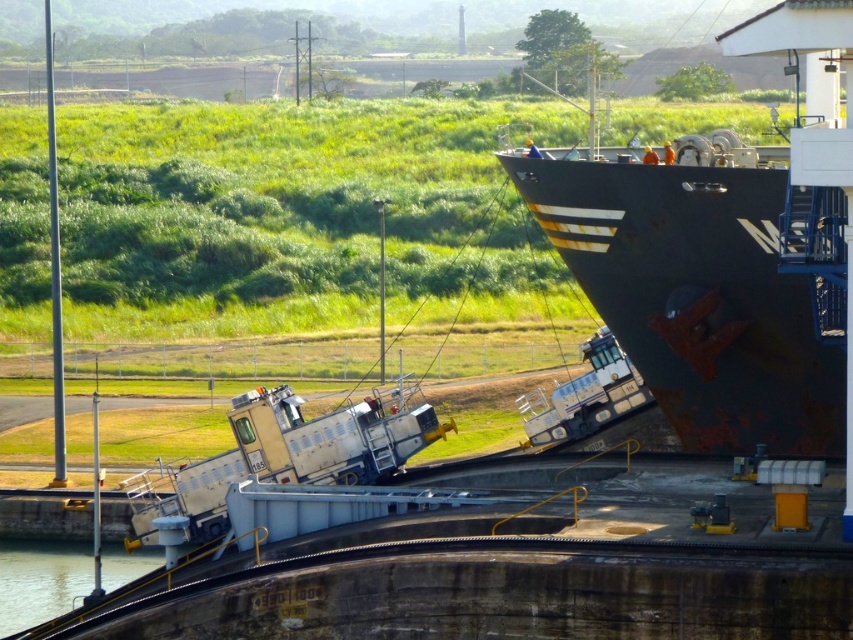
Question: Which point is closer to the camera taking this photo?

Choices:
 (A) (21, 577)
 (B) (790, 406)

Answer: (B)

Question: Does rusty metal ship at right appear under clear water at bottom left?

Choices:
 (A) yes
 (B) no

Answer: (B)

Question: Does rusty metal ship at right appear on the right side of clear water at bottom left?

Choices:
 (A) yes
 (B) no

Answer: (A)

Question: Which point appears closest to the camera in this image?

Choices:
 (A) (637, 365)
 (B) (73, 566)

Answer: (A)

Question: Can you confirm if rusty metal ship at right is thinner than clear water at bottom left?

Choices:
 (A) no
 (B) yes

Answer: (A)